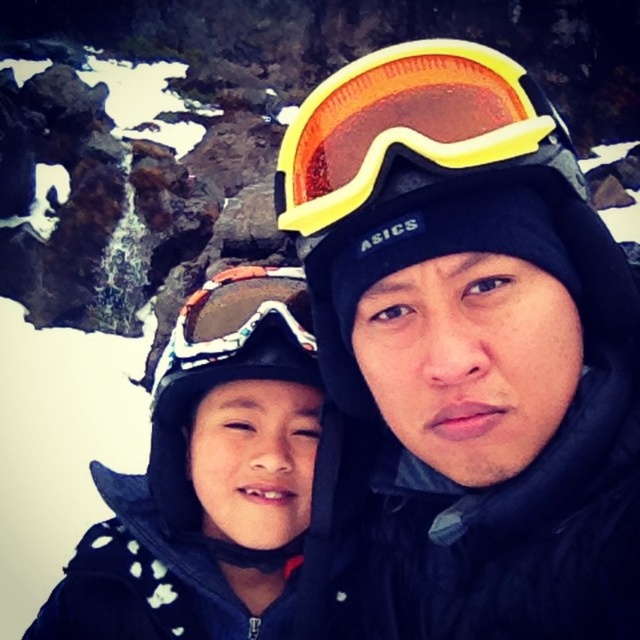
You are planning to take a photo of the white polka dot jacket at center and the yellow matte ski goggles at upper center. Which object should you focus on first if you want to ensure both are in the frame without moving the camera? Explain your reasoning based on their sizes.

The white polka dot jacket at center is bigger than the yellow matte ski goggles at upper center. Since the jacket is larger, it will occupy more space in the frame. Therefore, you should focus on the white polka dot jacket at center first to ensure it fits within the camera frame, and the smaller yellow matte ski goggles at upper center will naturally be included as well.

You are standing at the origin point in the image. Which of the two points, point (x=454, y=525) or point (x=468, y=125), is farther away from you?

Point (x=454, y=525) is behind point (x=468, y=125), so it is farther away from you.